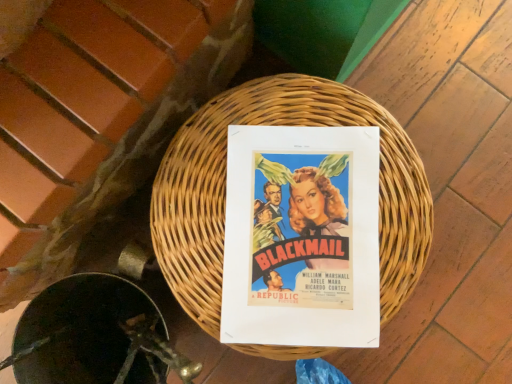
The width and height of the screenshot is (512, 384). In order to click on vacant region above matte paper poster at center (from a real-world perspective) in this screenshot , I will do `click(302, 240)`.